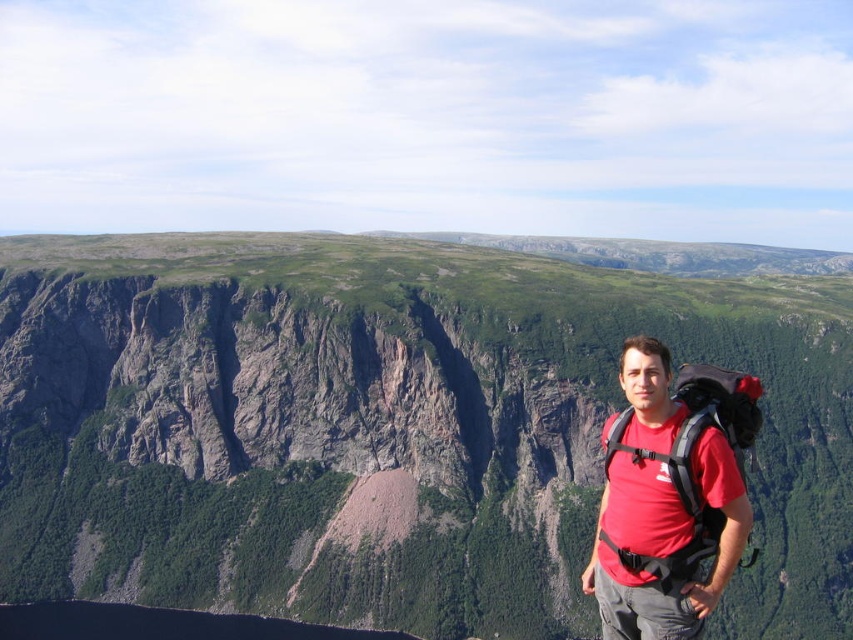
You are a hiker standing in the valley looking up at the cliffs. You see the green rock cliff at center and the matte black backpack at right. Which object is positioned more to the right from your perspective?

The matte black backpack at right is positioned more to the right than the green rock cliff at center.

You are standing at point (x=688, y=460) and want to move to point (x=421, y=577). Is the destination point behind you or in front of you?

The destination point (x=421, y=577) is behind point (x=688, y=460), so it is behind you.